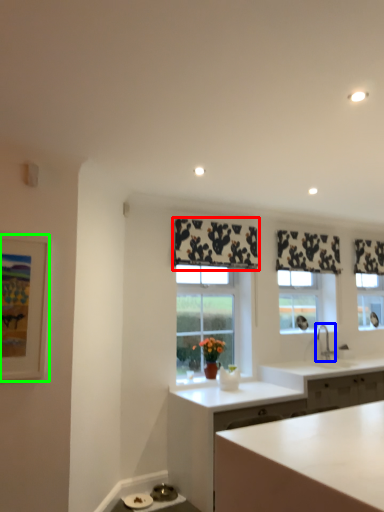
Question: Which object is the farthest from curtain (highlighted by a red box)? Choose among these: tap (highlighted by a blue box) or picture frame (highlighted by a green box).

Choices:
 (A) tap
 (B) picture frame

Answer: (B)